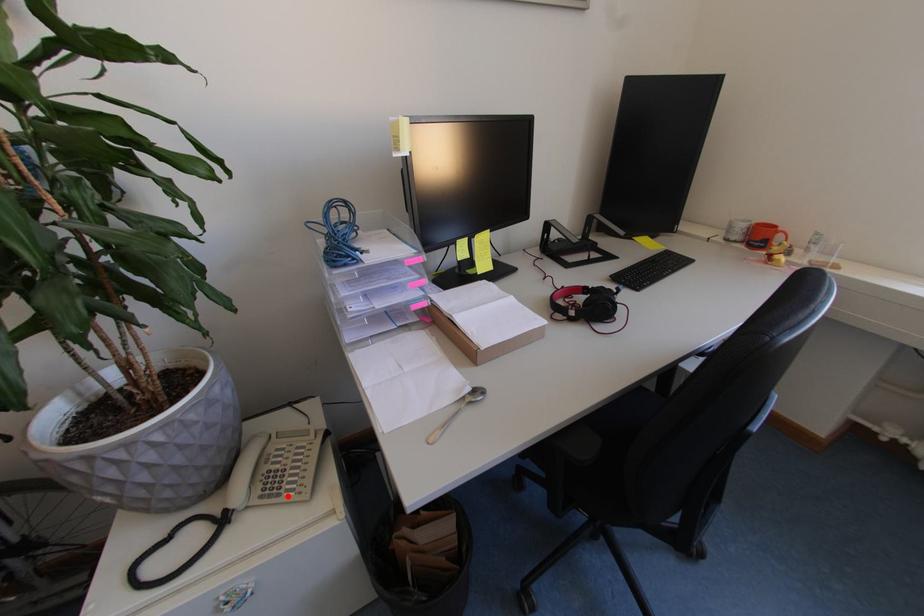
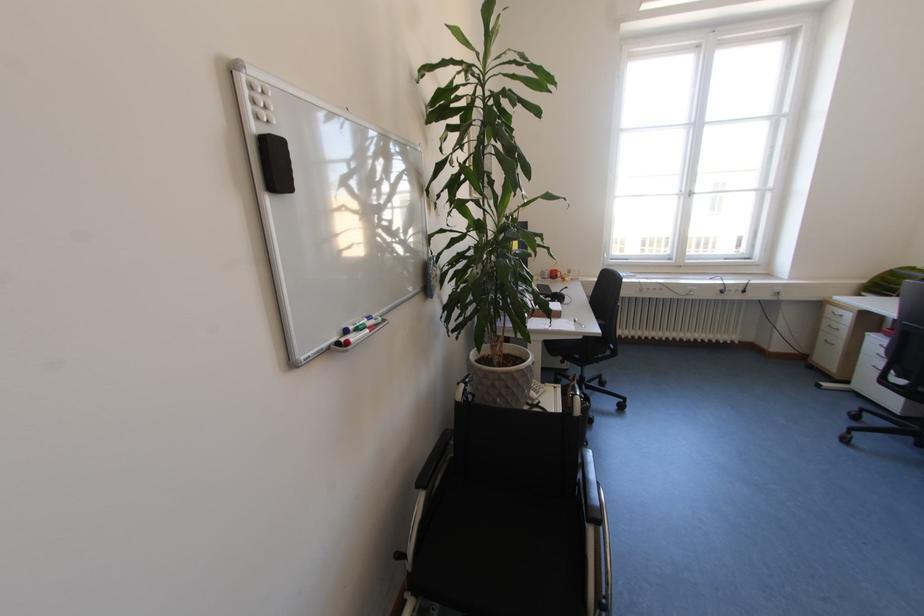
In the second image, find the point that corresponds to the highlighted location in the first image.

(546, 392)